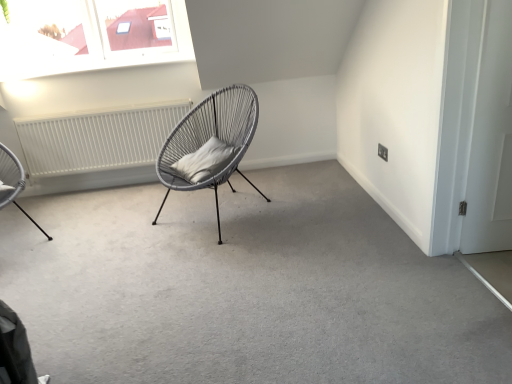
Find the location of a particular element. free spot in front of matte grey wicker chair at center, which appears as the 2th chair when viewed from the left is located at coordinates (215, 258).